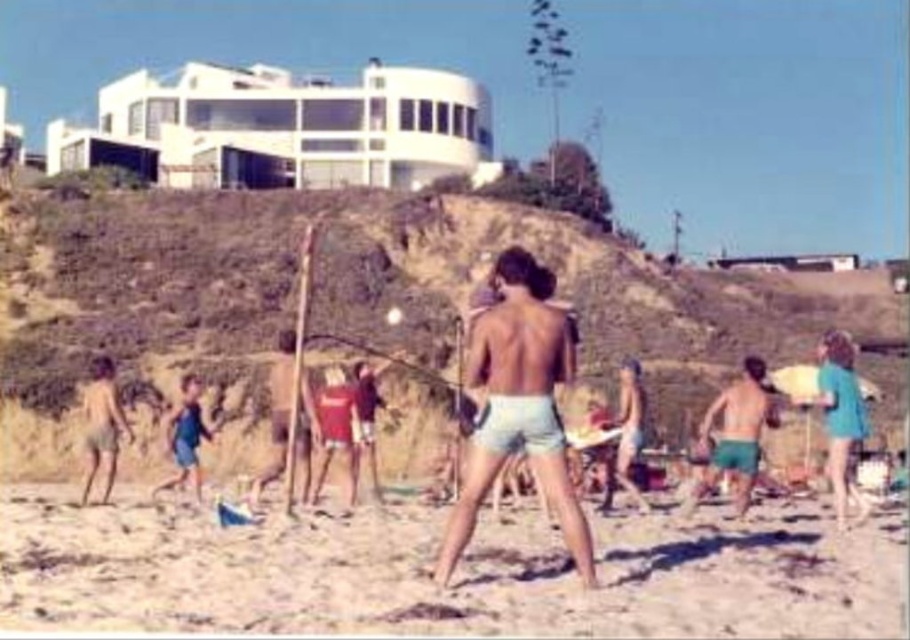
You are standing on the beach and see the green cotton shorts at right and the blue fabric shorts at lower left. Which direction should you walk to get closer to both of them?

Since the green cotton shorts at right is to the right of the blue fabric shorts at lower left, you should walk towards the right to get closer to both of them.

You are standing on the beach and want to take a photo of two specific points marked in the image. One is at point (698, 488) and the other at point (177, 461). Which point will appear larger in your photo?

Point (698, 488) is closer to the camera than point (177, 461), so it will appear larger in the photo.

You are a drone operator tasked with capturing aerial footage of the beach scene. The green cotton shorts at right and the blue fabric shorts at lower left are two focal points. Given the distance between them, can you estimate whether a single drone shot can capture both subjects in the frame without moving the camera?

The distance between the green cotton shorts at right and the blue fabric shorts at lower left is 48.72 meters. Depending on the drone camera lens and altitude, it might be possible to capture both in a single frame, but precise calculations would be needed to ensure the entire distance fits within the field of view.